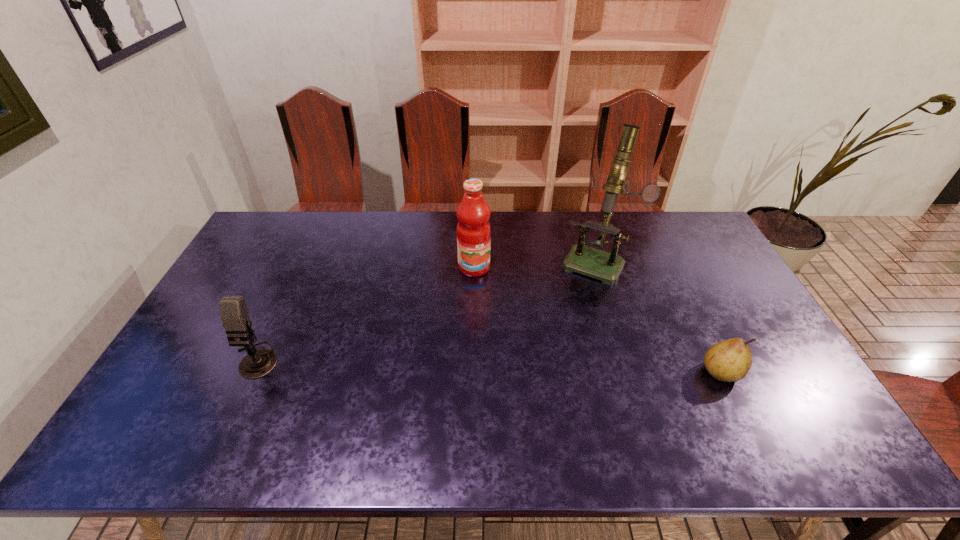
You are a GUI agent. You are given a task and a screenshot of the screen. Output one action in this format:
    pyautogui.click(x=<x>, y=<y>)
    Task: Click on the blank area at the far edge
    The height and width of the screenshot is (540, 960).
    Given the screenshot: What is the action you would take?
    pos(415,243)

The image size is (960, 540). Identify the location of vacant space at the near edge of the desktop. (506, 411).

Image resolution: width=960 pixels, height=540 pixels. In the image, there is a desktop. What are the coordinates of `vacant region at the left edge` in the screenshot? It's located at pos(256,255).

At what (x,y) coordinates should I click in order to perform the action: click on free region at the right edge of the desktop. Please return your answer as a coordinate pair (x, y). Image resolution: width=960 pixels, height=540 pixels. Looking at the image, I should click on (746, 299).

The width and height of the screenshot is (960, 540). In order to click on vacant area at the far left corner of the desktop in this screenshot , I will do (x=274, y=242).

Locate an element on the screen. The width and height of the screenshot is (960, 540). free region at the far right corner is located at coordinates (697, 223).

Locate an element on the screen. Image resolution: width=960 pixels, height=540 pixels. free area in between the second object from right to left and the microphone is located at coordinates (426, 310).

Where is `vacant area that lies between the microscope and the second tallest object`? This screenshot has height=540, width=960. vacant area that lies between the microscope and the second tallest object is located at coordinates (536, 264).

Identify the location of vacant point located between the tallest object and the pear. This screenshot has height=540, width=960. (660, 316).

Locate an element on the screen. This screenshot has width=960, height=540. empty space between the microscope and the leftmost object is located at coordinates (426, 310).